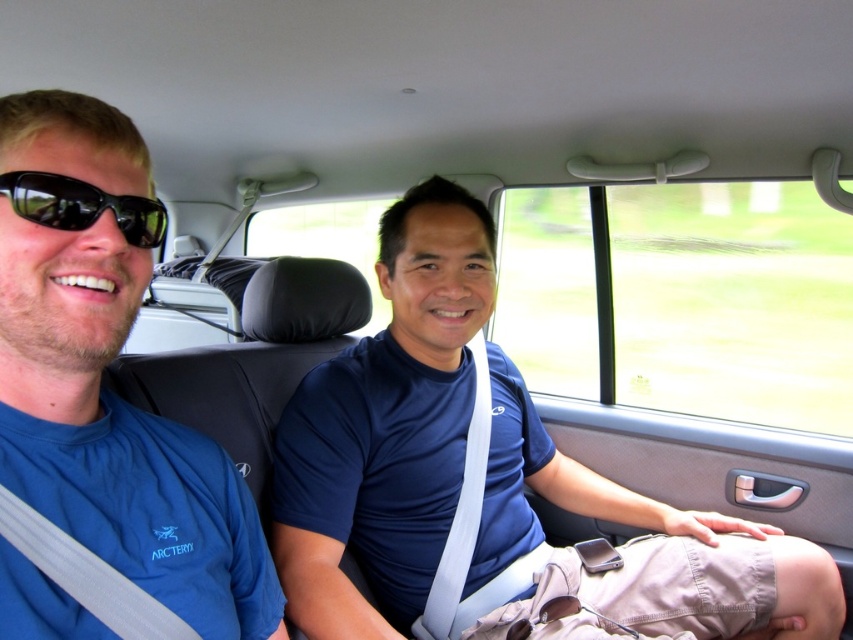
You are a photographer standing 4 feet away from the car window. You want to take a clear photo of the blue fabric shirt at center. Is the shirt within your camera range?

The blue fabric shirt at center is 3.95 feet away from the camera, so yes, it is within the photographer standing 4 feet away from the car window range and can be captured clearly.

You are sitting in the backseat of the car and want to reach both the point at coordinates (349, 490) and the point at (74, 161). Which point should you reach for first if you want to grab the one closer to you?

You should reach for point (74, 161) first because it is closer to you than point (349, 490), which is further away.

You are a fashion designer analyzing clothing items in a car. You notice the blue fabric shirt at left and the black plastic sunglasses at left. Which item takes up more horizontal space in the image?

The blue fabric shirt at left is wider than the black plastic sunglasses at left, so the blue fabric shirt at left takes up more horizontal space.